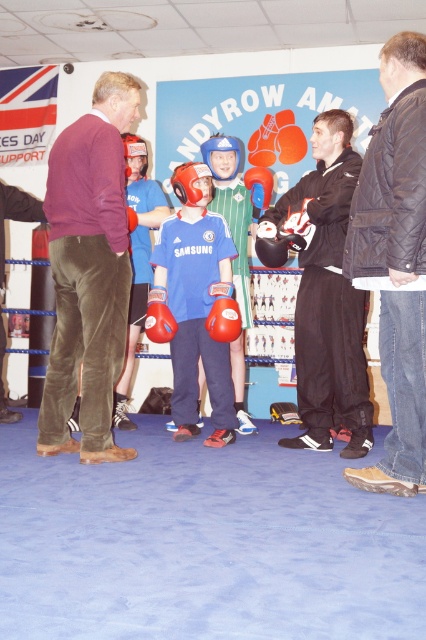
Which is behind, point (86, 134) or point (302, 317)?

The point (302, 317) is more distant.

Is maroon sweater at center to the left of black matte jacket at center from the viewer's perspective?

Correct, you'll find maroon sweater at center to the left of black matte jacket at center.

Between point (81, 186) and point (325, 209), which one is positioned behind?

The point (325, 209) is behind.

You are a GUI agent. You are given a task and a screenshot of the screen. Output one action in this format:
    pyautogui.click(x=<x>, y=<y>)
    Task: Click on the maroon sweater at center
    
    Given the screenshot: What is the action you would take?
    pyautogui.click(x=89, y=273)

Is maroon sweater at center in front of black quilted jacket at right?

No, maroon sweater at center is behind black quilted jacket at right.

Image resolution: width=426 pixels, height=640 pixels. What do you see at coordinates (89, 273) in the screenshot?
I see `maroon sweater at center` at bounding box center [89, 273].

This screenshot has height=640, width=426. I want to click on maroon sweater at center, so click(x=89, y=273).

Between black quilted jacket at right and black matte jacket at center, which one appears on the left side from the viewer's perspective?

From the viewer's perspective, black matte jacket at center appears more on the left side.

Can you confirm if black quilted jacket at right is shorter than black matte jacket at center?

In fact, black quilted jacket at right may be taller than black matte jacket at center.

Between point (374, 256) and point (344, 353), which one is positioned in front?

Point (374, 256) is more forward.

The image size is (426, 640). Find the location of `black quilted jacket at right`. black quilted jacket at right is located at coordinates (396, 260).